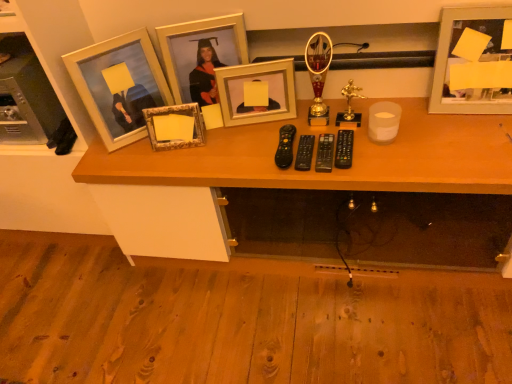
You are a GUI agent. You are given a task and a screenshot of the screen. Output one action in this format:
    pyautogui.click(x=<x>, y=<y>)
    Task: Click on the vacant space situated on the left part of gold metallic picture frame at center, which is counted as the 4th picture frame, starting from the left
    
    Given the screenshot: What is the action you would take?
    pyautogui.click(x=219, y=138)